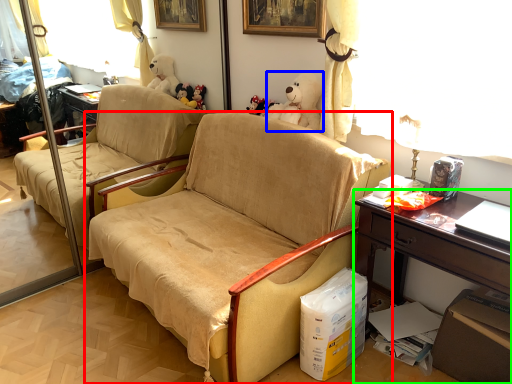
Question: Considering the real-world distances, which object is closest to chair (highlighted by a red box)? toy (highlighted by a blue box) or desk (highlighted by a green box).

Choices:
 (A) toy
 (B) desk

Answer: (B)